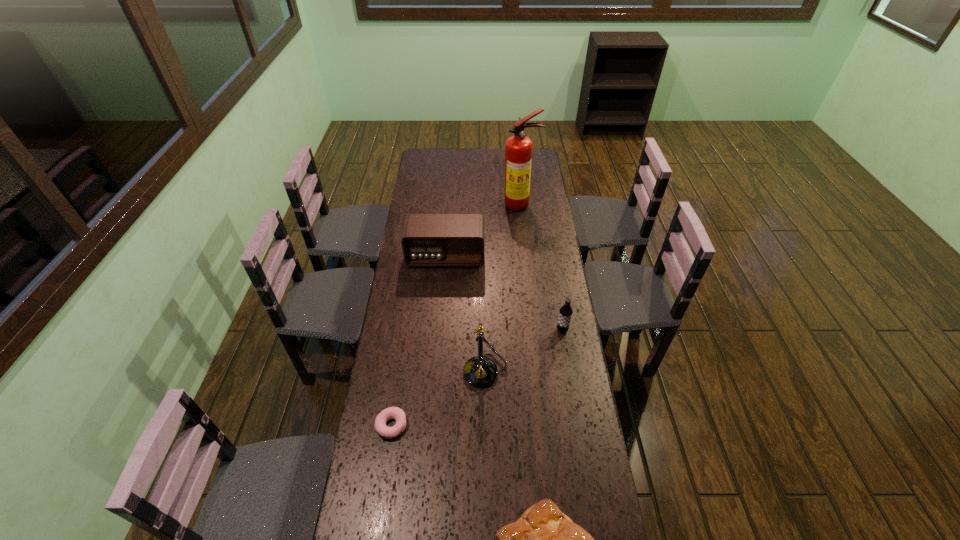
The image size is (960, 540). I want to click on blank space that satisfies the following two spatial constraints: 1. on the front-facing side of the fire extinguisher; 2. on the dial of the third nearest object, so click(538, 371).